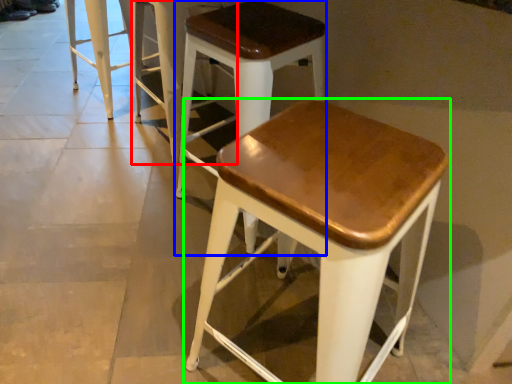
Question: Based on their relative distances, which object is nearer to stool (highlighted by a red box)? Choose from stool (highlighted by a blue box) and stool (highlighted by a green box).

Choices:
 (A) stool
 (B) stool

Answer: (A)